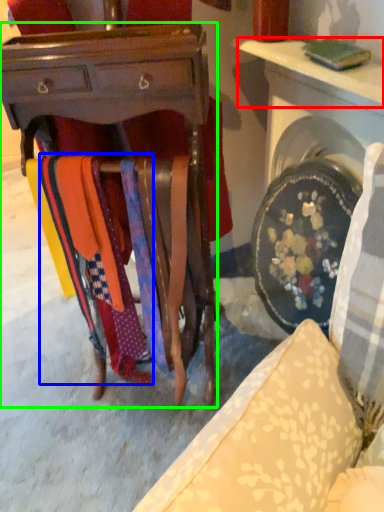
Question: Estimate the real-world distances between objects in this image. Which object is farther from table (highlighted by a red box), fabric (highlighted by a blue box) or desk (highlighted by a green box)?

Choices:
 (A) fabric
 (B) desk

Answer: (A)